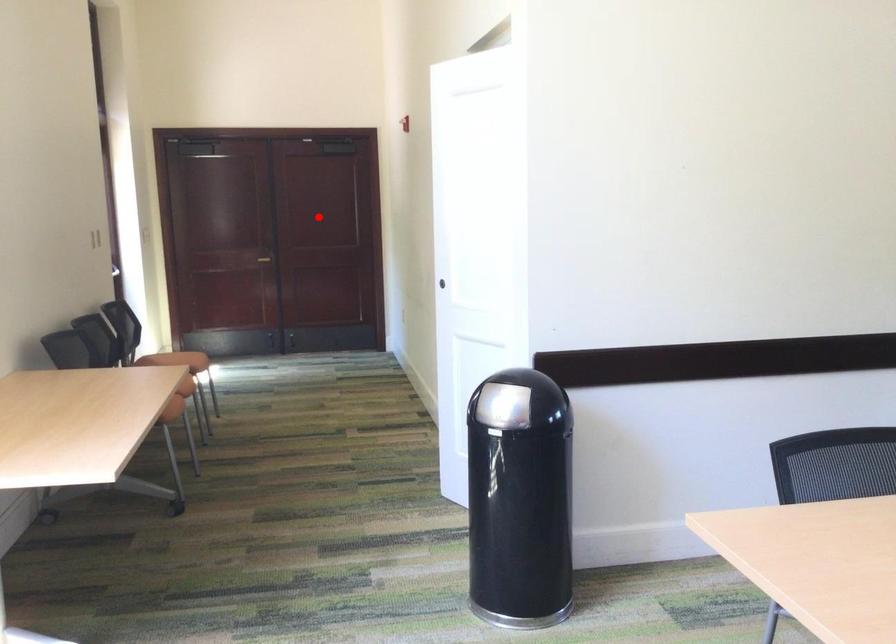
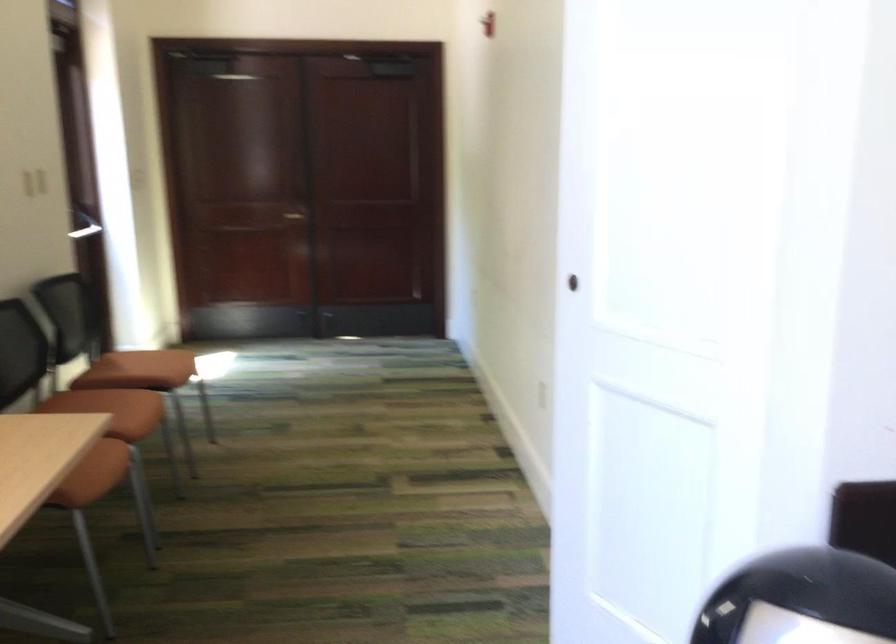
Question: A red point is marked in image1. In image2, is the corresponding 3D point closer to the camera or farther? Reply with the corresponding letter.

Choices:
 (A) The corresponding 3D point is closer.
 (B) The corresponding 3D point is farther.

Answer: (A)